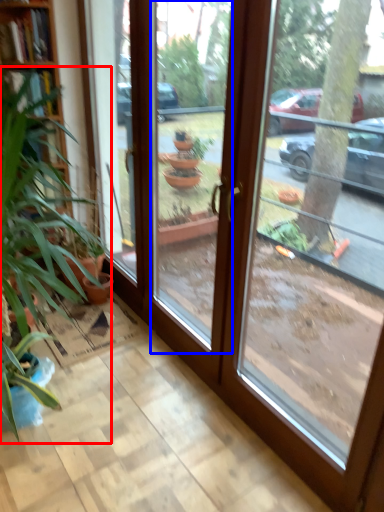
Question: Among these objects, which one is farthest to the camera, houseplant (highlighted by a red box) or window (highlighted by a blue box)?

Choices:
 (A) houseplant
 (B) window

Answer: (A)